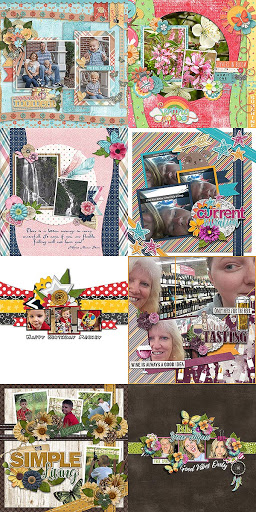
The width and height of the screenshot is (256, 512). In order to click on wine bottles in this screenshot , I will do `click(179, 305)`, `click(182, 291)`, `click(180, 278)`.